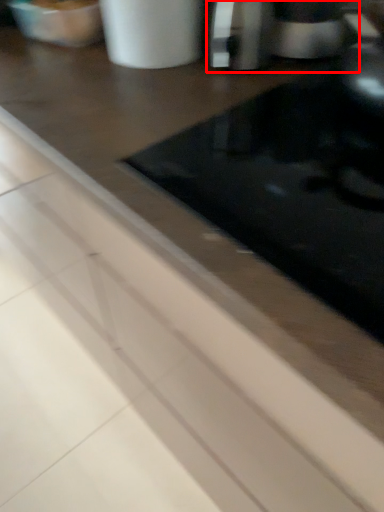
Question: Where is coffee machine (annotated by the red box) located in relation to appliance in the image?

Choices:
 (A) right
 (B) left

Answer: (A)